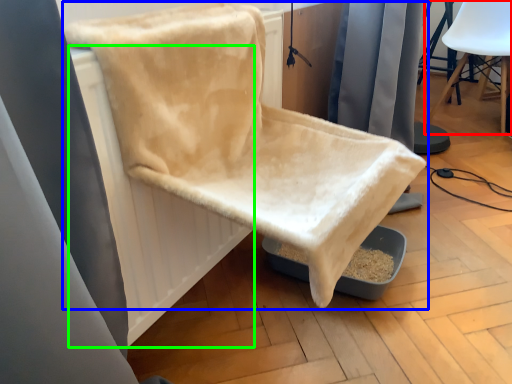
Question: Estimate the real-world distances between objects in this image. Which object is farther from chair (highlighted by a red box), chair (highlighted by a blue box) or radiator (highlighted by a green box)?

Choices:
 (A) chair
 (B) radiator

Answer: (B)